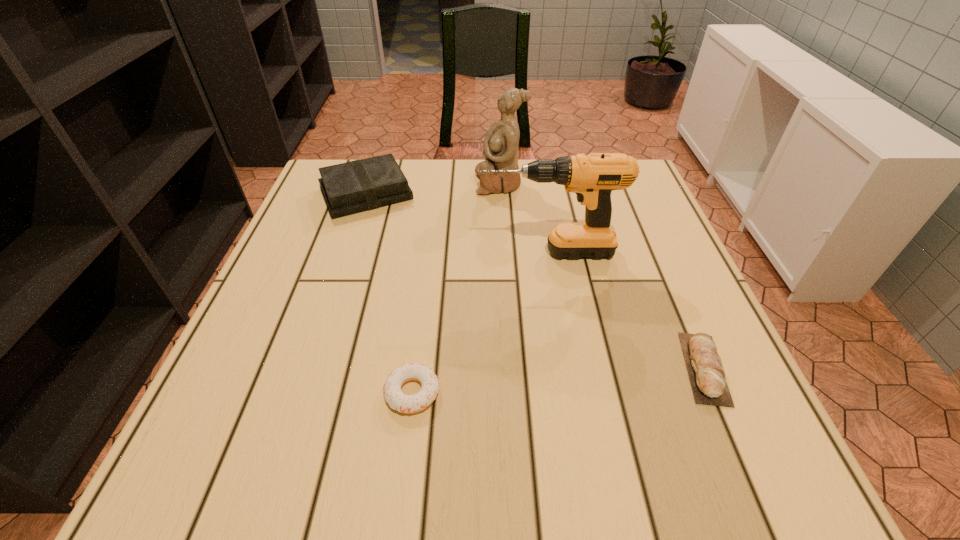
Where is `vacant space that satisfies the following two spatial constraints: 1. at the tip of the rightmost object; 2. on the left side of the third farthest object`? This screenshot has width=960, height=540. vacant space that satisfies the following two spatial constraints: 1. at the tip of the rightmost object; 2. on the left side of the third farthest object is located at coordinates click(566, 368).

Where is `free space that satisfies the following two spatial constraints: 1. on the front side of the rightmost object; 2. on the left side of the leftmost object`? This screenshot has width=960, height=540. free space that satisfies the following two spatial constraints: 1. on the front side of the rightmost object; 2. on the left side of the leftmost object is located at coordinates (308, 368).

Where is `free region that satisfies the following two spatial constraints: 1. on the front-facing side of the figurine; 2. on the front side of the leftmost object`? The image size is (960, 540). free region that satisfies the following two spatial constraints: 1. on the front-facing side of the figurine; 2. on the front side of the leftmost object is located at coordinates (500, 193).